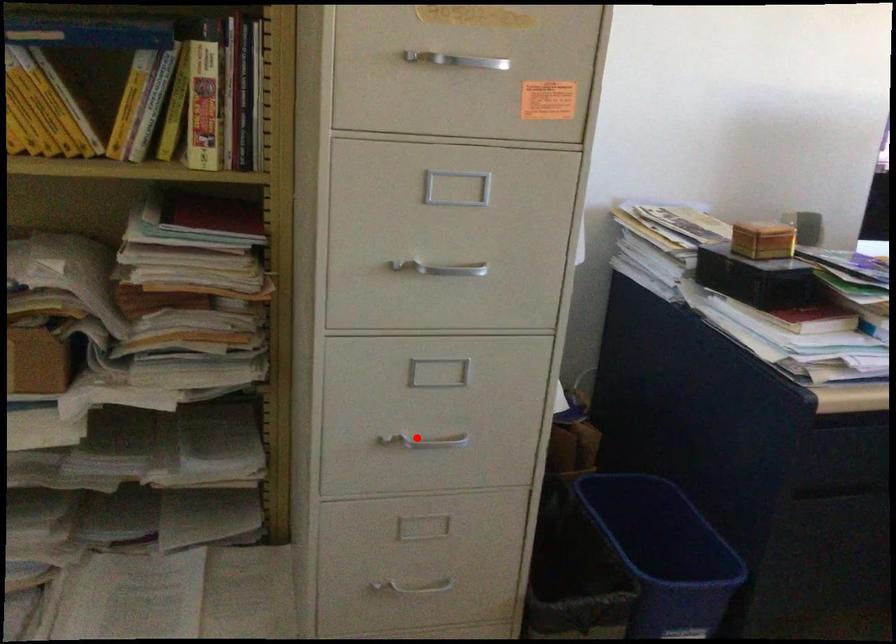
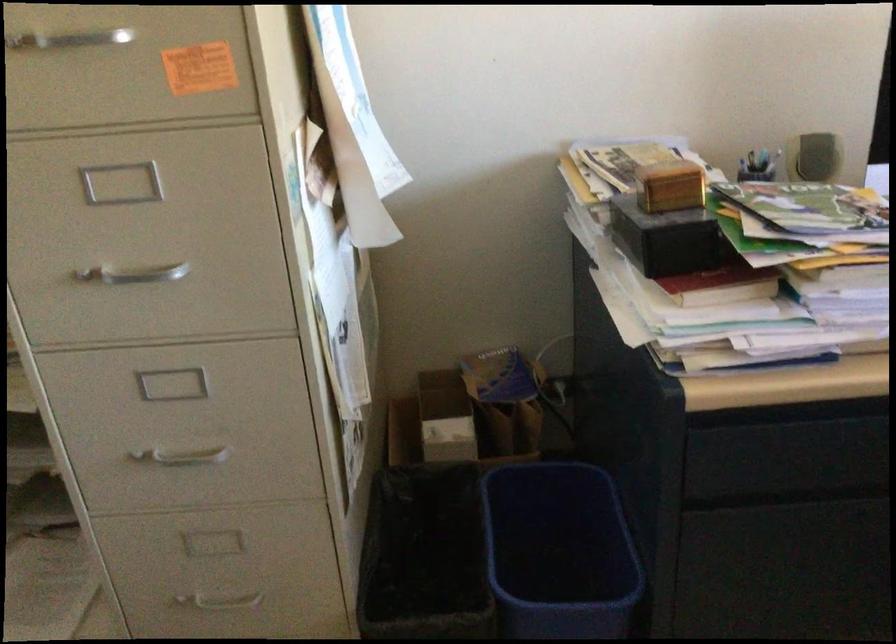
Question: I am providing you with two images of the same scene from different viewpoints. A red point is marked on the first image. Can you still see the location of the red point in image 2?

Choices:
 (A) Yes
 (B) No

Answer: (A)